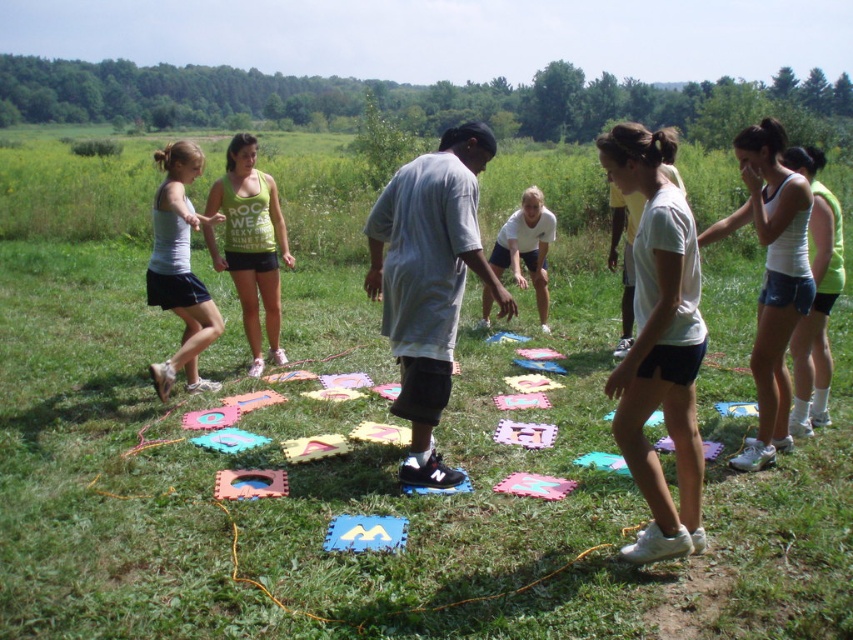
Who is lower down, white matte shorts at center or white matte shirt at center?

Positioned lower is white matte shorts at center.

Is white matte shorts at center in front of white matte shirt at center?

Yes, white matte shorts at center is in front of white matte shirt at center.

What do you see at coordinates (659, 342) in the screenshot? I see `white matte shorts at center` at bounding box center [659, 342].

Where is `white matte shorts at center`? This screenshot has width=853, height=640. white matte shorts at center is located at coordinates (659, 342).

Is the position of white matte shorts at center less distant than that of white matte tank top at upper right?

Yes, it is.

Find the location of a particular element. Image resolution: width=853 pixels, height=640 pixels. white matte shorts at center is located at coordinates (659, 342).

Does matte gray tank top at left have a lesser height compared to white matte shirt at center?

Incorrect, matte gray tank top at left's height does not fall short of white matte shirt at center's.

Who is more forward, (184, 288) or (532, 189)?

Point (184, 288) is more forward.

I want to click on matte gray tank top at left, so click(x=178, y=268).